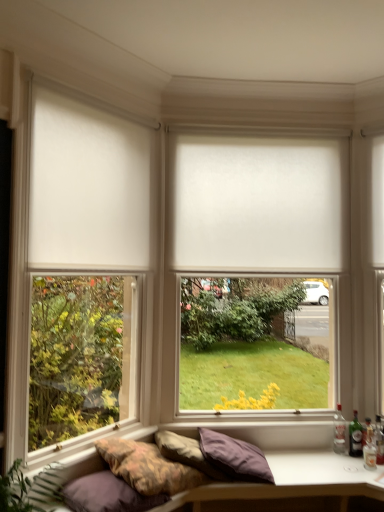
In order to click on vacant space to the left of translucent glass bottle at right, the 4th bottle from the left in this screenshot , I will do `click(352, 464)`.